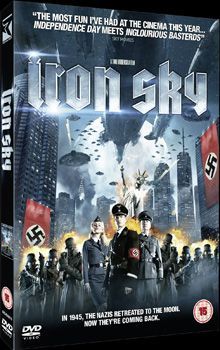
Locate an element on the screen. sticker is located at coordinates (200, 309).